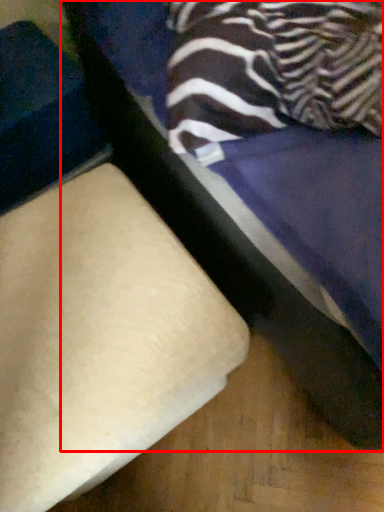
Question: In this image, where is furniture (annotated by the red box) located relative to furniture?

Choices:
 (A) right
 (B) left

Answer: (A)